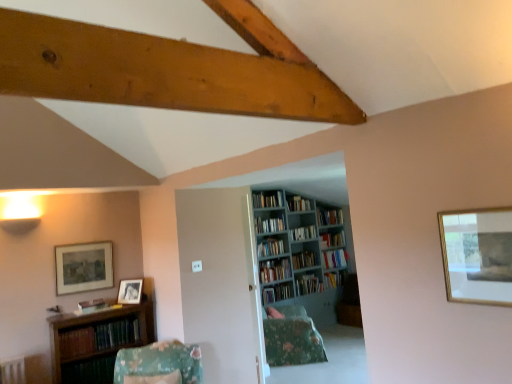
Question: Considering the positions of hardcover book at center, positioned as the first book in back-to-front order, and matte wooden picture frame at left, which is the 2th picture frame in top-to-bottom order, in the image, is hardcover book at center, positioned as the first book in back-to-front order, taller or shorter than matte wooden picture frame at left, which is the 2th picture frame in top-to-bottom order,?

Choices:
 (A) tall
 (B) short

Answer: (B)

Question: Looking at their shapes, would you say hardcover book at center, positioned as the ninth book in front-to-back order, is wider or thinner than matte wooden picture frame at left, which appears as the second picture frame when viewed from the back?

Choices:
 (A) wide
 (B) thin

Answer: (A)

Question: Which object is positioned closest to the green painted wood bookcase at center?

Choices:
 (A) hardcover book at center, which is the 3th book in back-to-front order
 (B) wooden bookshelf at lower left
 (C) matte wooden picture frame at left, the 3th picture frame viewed from the right
 (D) hardcover book at center, positioned as the first book in back-to-front order
 (E) hardcover book at center, positioned as the 7th book in back-to-front order

Answer: (E)

Question: Estimate the real-world distances between objects in this image. Which object is farther from the hardcover books at center, which is counted as the 5th book, starting from the back?

Choices:
 (A) hardcover book at center, the 7th book when ordered from front to back
 (B) wooden bookshelf at lower left
 (C) hardcover book at center, positioned as the first book in back-to-front order
 (D) hardcover book at lower left, the 1th book positioned from the front
 (E) hardcover books at lower left, which is the eighth book in back-to-front order

Answer: (D)